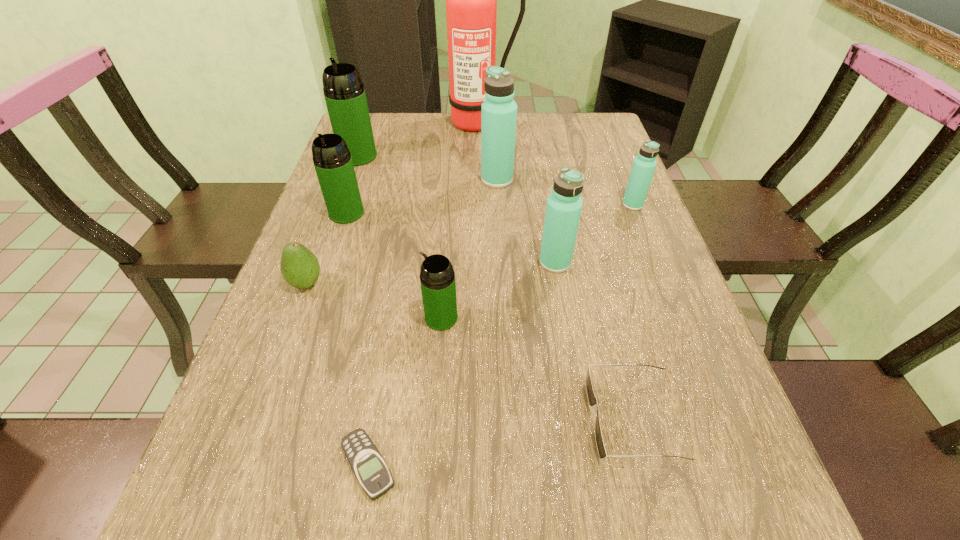
Find the location of a particular element. vacant space located from the spout of the second farthest green thermos bottle is located at coordinates (312, 315).

Image resolution: width=960 pixels, height=540 pixels. Identify the location of blank area located on the left of the second nearest thermos bottle. pyautogui.click(x=478, y=262).

At what (x,y) coordinates should I click in order to perform the action: click on free region located 0.400m on the left of the rightmost aqua thermos bottle. Please return your answer as a coordinate pair (x, y). Image resolution: width=960 pixels, height=540 pixels. Looking at the image, I should click on (469, 205).

Identify the location of vacant space located from the spout of the rightmost green thermos bottle. (385, 318).

Where is `free space located 0.300m from the spout of the rightmost green thermos bottle`? free space located 0.300m from the spout of the rightmost green thermos bottle is located at coordinates (276, 318).

Locate an element on the screen. This screenshot has width=960, height=540. free region located 0.240m from the spout of the rightmost green thermos bottle is located at coordinates tap(306, 318).

At what (x,y) coordinates should I click in order to perform the action: click on vacant space located 0.190m on the right of the eighth tallest object. Please return your answer as a coordinate pair (x, y). Looking at the image, I should click on (411, 284).

The width and height of the screenshot is (960, 540). Identify the location of vacant space situated 0.270m on the front-facing side of the ninth tallest object. (430, 418).

The width and height of the screenshot is (960, 540). In order to click on free space located 0.090m on the front-facing side of the ninth tallest object in this screenshot , I will do `click(538, 418)`.

Locate an element on the screen. free spot located 0.370m on the front-facing side of the ninth tallest object is located at coordinates (371, 418).